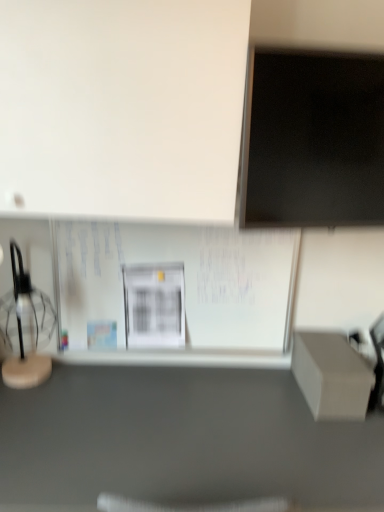
The image size is (384, 512). In order to click on matte gray box at lower right in this screenshot , I will do `click(181, 440)`.

Find the location of a particular element. black matte computer monitor at upper right is located at coordinates (313, 140).

This screenshot has width=384, height=512. I want to click on white paperboard at center, so click(x=174, y=287).

Where is `matte gray box at lower right`? This screenshot has width=384, height=512. matte gray box at lower right is located at coordinates (181, 440).

Is translucent glass table lamp at left positioned with its back to matte gray box at lower right?

No, translucent glass table lamp at left is not facing away from matte gray box at lower right.

Would you say matte gray box at lower right is part of translucent glass table lamp at left's contents?

No, matte gray box at lower right is not surrounded by translucent glass table lamp at left.

Based on the photo, can you confirm if translucent glass table lamp at left is thinner than matte gray box at lower right?

Yes, translucent glass table lamp at left is thinner than matte gray box at lower right.

Where is `furniture that is below the translucent glass table lamp at left (from the image's perspective)`? furniture that is below the translucent glass table lamp at left (from the image's perspective) is located at coordinates (181, 440).

Looking at this image, does white paperboard at center lie behind translucent glass table lamp at left?

Yes, white paperboard at center is further from the camera.

Is point (104, 252) positioned before point (17, 366)?

No.

Is white paperboard at center positioned far away from translucent glass table lamp at left?

No.

Is matte gray box at lower right thinner than black matte computer monitor at upper right?

In fact, matte gray box at lower right might be wider than black matte computer monitor at upper right.

From a real-world perspective, is matte gray box at lower right positioned under black matte computer monitor at upper right based on gravity?

Correct, in the physical world, matte gray box at lower right is lower than black matte computer monitor at upper right.

In the image, is matte gray box at lower right positioned in front of or behind black matte computer monitor at upper right?

matte gray box at lower right is positioned closer to the viewer than black matte computer monitor at upper right.

From the image's perspective, is matte gray box at lower right on top of black matte computer monitor at upper right?

No, from the image's perspective, matte gray box at lower right is not on top of black matte computer monitor at upper right.

Is translucent glass table lamp at left surrounding white paperboard at center?

Definitely not — white paperboard at center is not inside translucent glass table lamp at left.

From the image's perspective, does translucent glass table lamp at left appear lower than white paperboard at center?

Indeed, from the image's perspective, translucent glass table lamp at left is shown beneath white paperboard at center.

Is translucent glass table lamp at left shorter than white paperboard at center?

Yes, translucent glass table lamp at left is shorter than white paperboard at center.

Would you say black matte computer monitor at upper right is outside matte gray box at lower right?

Yes, black matte computer monitor at upper right is not within matte gray box at lower right.

From their relative heights in the image, would you say black matte computer monitor at upper right is taller or shorter than matte gray box at lower right?

In the image, black matte computer monitor at upper right appears to be shorter than matte gray box at lower right.

Which object is further away from the camera, black matte computer monitor at upper right or matte gray box at lower right?

black matte computer monitor at upper right is more distant.

What's the angular difference between black matte computer monitor at upper right and matte gray box at lower right's facing directions?

black matte computer monitor at upper right and matte gray box at lower right are facing 8.4 degrees away from each other.

What's the angular difference between black matte computer monitor at upper right and translucent glass table lamp at left's facing directions?

There is a 8.4-degree angle between the facing directions of black matte computer monitor at upper right and translucent glass table lamp at left.

Looking at their sizes, would you say black matte computer monitor at upper right is wider or thinner than translucent glass table lamp at left?

In the image, black matte computer monitor at upper right appears to be more narrow than translucent glass table lamp at left.

This screenshot has height=512, width=384. I want to click on table lamp located on the left of black matte computer monitor at upper right, so click(x=25, y=328).

Is black matte computer monitor at upper right oriented towards translucent glass table lamp at left?

No.

From a real-world perspective, is matte gray box at lower right on top of translucent glass table lamp at left?

No, from a real-world perspective, matte gray box at lower right is not over translucent glass table lamp at left

In terms of width, does matte gray box at lower right look wider or thinner when compared to translucent glass table lamp at left?

In the image, matte gray box at lower right appears to be wider than translucent glass table lamp at left.

Considering the relative positions of matte gray box at lower right and translucent glass table lamp at left in the image provided, is matte gray box at lower right to the left of translucent glass table lamp at left from the viewer's perspective?

No.

Find the location of a particular element. table lamp that appears above the matte gray box at lower right (from the image's perspective) is located at coordinates (25, 328).

Where is `table lamp to the left of white paperboard at center`? table lamp to the left of white paperboard at center is located at coordinates pyautogui.click(x=25, y=328).

Considering their positions, is translucent glass table lamp at left positioned closer to black matte computer monitor at upper right than matte gray box at lower right?

Among the two, matte gray box at lower right is located nearer to black matte computer monitor at upper right.

Based on their spatial positions, is black matte computer monitor at upper right or white paperboard at center closer to translucent glass table lamp at left?

white paperboard at center is closer to translucent glass table lamp at left.

Which object lies further to the anchor point black matte computer monitor at upper right, white paperboard at center or translucent glass table lamp at left?

translucent glass table lamp at left lies further to black matte computer monitor at upper right than the other object.

From the picture: Considering their positions, is white paperboard at center positioned further to translucent glass table lamp at left than matte gray box at lower right?

matte gray box at lower right.

Estimate the real-world distances between objects in this image. Which object is further from translucent glass table lamp at left, white paperboard at center or black matte computer monitor at upper right?

Based on the image, black matte computer monitor at upper right appears to be further to translucent glass table lamp at left.

When comparing their distances from translucent glass table lamp at left, does matte gray box at lower right or black matte computer monitor at upper right seem closer?

Based on the image, matte gray box at lower right appears to be nearer to translucent glass table lamp at left.

From the image, which object appears to be farther from translucent glass table lamp at left, matte gray box at lower right or white paperboard at center?

The object further to translucent glass table lamp at left is matte gray box at lower right.

When comparing their distances from white paperboard at center, does black matte computer monitor at upper right or translucent glass table lamp at left seem closer?

translucent glass table lamp at left is positioned closer to the anchor white paperboard at center.

You are a GUI agent. You are given a task and a screenshot of the screen. Output one action in this format:
    pyautogui.click(x=<x>, y=<y>)
    Task: Click on the table lamp between black matte computer monitor at upper right and matte gray box at lower right in the up-down direction
    
    Given the screenshot: What is the action you would take?
    pyautogui.click(x=25, y=328)

The height and width of the screenshot is (512, 384). Identify the location of bulletin board between translucent glass table lamp at left and black matte computer monitor at upper right. (174, 287).

Locate an element on the screen. This screenshot has width=384, height=512. bulletin board between black matte computer monitor at upper right and matte gray box at lower right vertically is located at coordinates [174, 287].

Find the location of `table lamp between white paperboard at center and matte gray box at lower right vertically`. table lamp between white paperboard at center and matte gray box at lower right vertically is located at coordinates (25, 328).